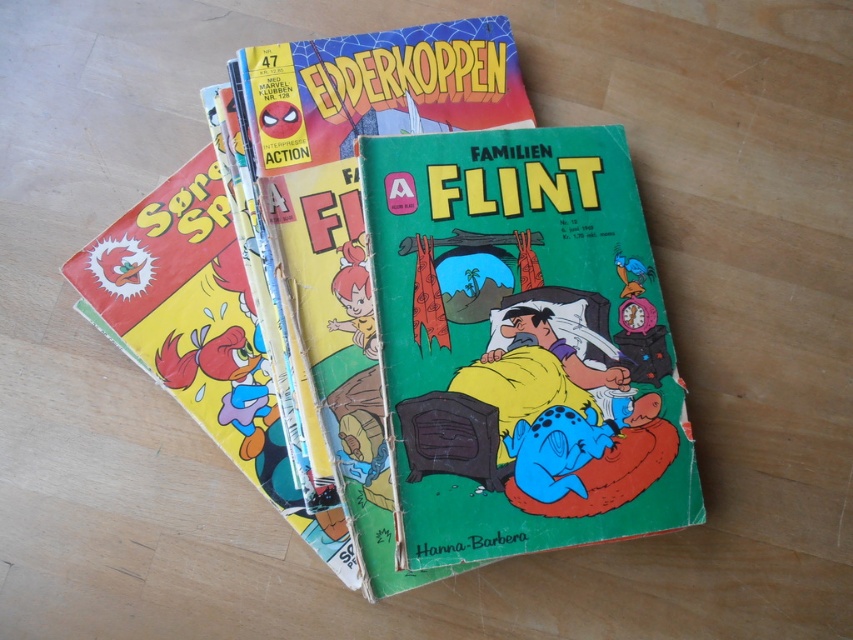
You are organizing a comic book collection and need to place a new comic between the matte yellow comic book at center and the green glossy comic book at center. Which side should you place it on to maintain the current arrangement?

You should place the new comic to the right of the matte yellow comic book at center and to the left of the green glossy comic book at center since the matte yellow comic book at center is already positioned to the left of the green glossy comic book at center.